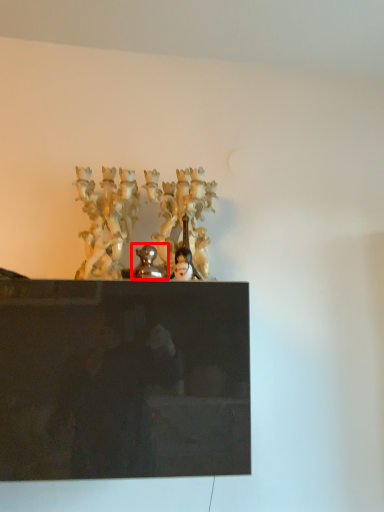
Question: In this image, where is sculpture (annotated by the red box) located relative to person?

Choices:
 (A) right
 (B) left

Answer: (B)